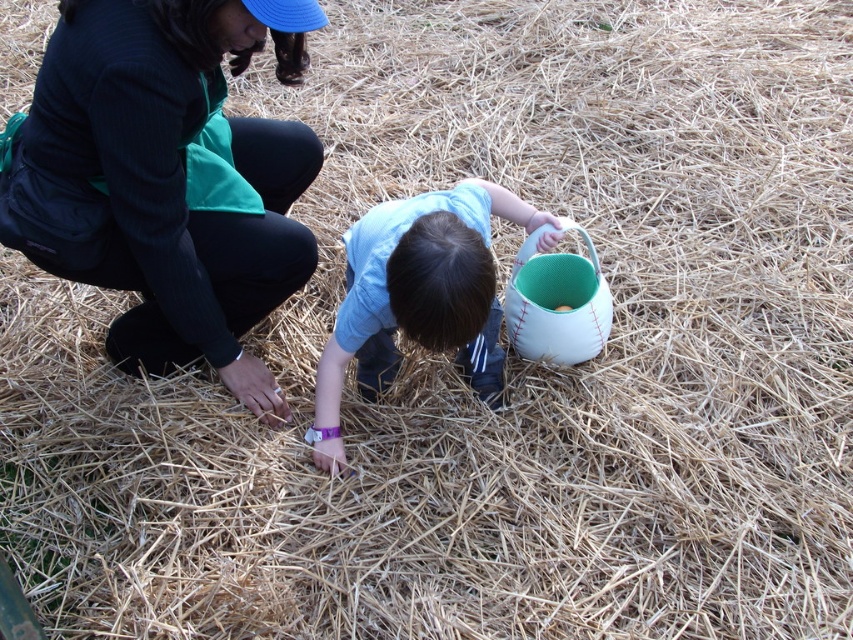
Question: Is green fabric jacket at upper left to the left of light blue fabric shirt at center from the viewer's perspective?

Choices:
 (A) no
 (B) yes

Answer: (B)

Question: Which object appears farthest from the camera in this image?

Choices:
 (A) green fabric jacket at upper left
 (B) light blue fabric shirt at center

Answer: (B)

Question: In this image, where is green fabric jacket at upper left located relative to light blue fabric shirt at center?

Choices:
 (A) left
 (B) right

Answer: (A)

Question: Is green fabric jacket at upper left wider than light blue fabric shirt at center?

Choices:
 (A) no
 (B) yes

Answer: (B)